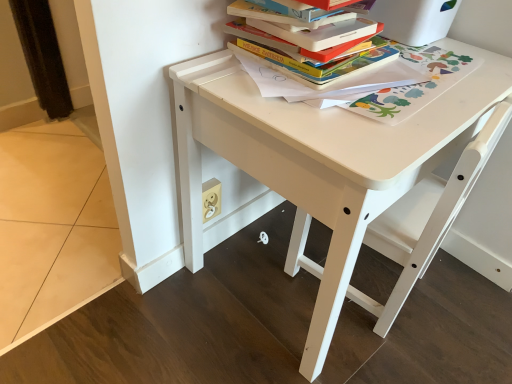
What is the approximate width of white matte table at center?

white matte table at center is 46.55 centimeters in width.

Measure the distance between white matte chair at center and camera.

The depth of white matte chair at center is 26.23 inches.

Measure the distance between point (379, 29) and camera.

Point (379, 29) and camera are 33.54 inches apart from each other.

At what (x,y) coordinates should I click in order to perform the action: click on white matte table at center. Please return your answer as a coordinate pair (x, y). Looking at the image, I should click on (335, 169).

Is hardcover books at upper center turned away from white matte chair at center?

hardcover books at upper center is not turned away from white matte chair at center.

Is hardcover books at upper center directly adjacent to white matte chair at center?

They are not placed beside each other.

How different are the orientations of hardcover books at upper center and hardcover book at upper center in degrees?

The angular difference between hardcover books at upper center and hardcover book at upper center is 0.000134 degrees.

From a real-world perspective, who is located lower, hardcover books at upper center or hardcover book at upper center?

hardcover books at upper center is physically lower.

From the image's perspective, is hardcover books at upper center over hardcover book at upper center?

No.

Identify the location of paperback book on the left side of hardcover books at upper center. Image resolution: width=512 pixels, height=384 pixels. (322, 33).

Which object is positioned more to the left, white matte chair at center or white matte table at center?

white matte table at center is more to the left.

In order to click on table above the white matte chair at center (from a real-world perspective) in this screenshot , I will do `click(335, 169)`.

From the image's perspective, between white matte chair at center and white matte table at center, which one is located above?

white matte table at center, from the image's perspective.

From a real-world perspective, is hardcover book at upper center positioned above or below hardcover books at upper center?

hardcover book at upper center is above hardcover books at upper center.

Would you say hardcover book at upper center is outside hardcover books at upper center?

Absolutely, hardcover book at upper center is external to hardcover books at upper center.

Which is in front, point (343, 39) or point (320, 69)?

The point (320, 69) is in front.

From the image's perspective, which one is positioned lower, hardcover book at upper center or hardcover books at upper center?

hardcover books at upper center.

From the image's perspective, is white matte chair at center over hardcover book at upper center?

No.

I want to click on chair in front of the hardcover book at upper center, so click(x=426, y=218).

Is white matte chair at center positioned far away from hardcover book at upper center?

white matte chair at center is actually quite close to hardcover book at upper center.

Is white matte chair at center in front of or behind hardcover book at upper center in the image?

white matte chair at center is in front of hardcover book at upper center.

Considering the points (187, 105) and (490, 144), which point is in front, point (187, 105) or point (490, 144)?

The point (490, 144) is in front.

Is white matte table at center in front of white matte chair at center?

Yes, white matte table at center is closer to the camera.

Does white matte table at center have a smaller size compared to white matte chair at center?

No.

From the picture: From the image's perspective, which one is positioned higher, white matte table at center or white matte chair at center?

white matte table at center appears higher in the image.

Between white matte chair at center and hardcover books at upper center, which one has smaller size?

With smaller size is hardcover books at upper center.

From the image's perspective, who appears lower, white matte chair at center or hardcover books at upper center?

white matte chair at center appears lower in the image.

Which is in front, white matte chair at center or hardcover books at upper center?

white matte chair at center is closer to the camera.

The width and height of the screenshot is (512, 384). I want to click on chair that appears below the hardcover books at upper center (from the image's perspective), so click(426, 218).

Where is `book that appears on the right of hardcover book at upper center`? The height and width of the screenshot is (384, 512). book that appears on the right of hardcover book at upper center is located at coordinates (311, 54).

Looking at the image, which one is located closer to hardcover books at upper center, hardcover book at upper center or white matte chair at center?

hardcover book at upper center.

Which object lies further to the anchor point hardcover books at upper center, white matte table at center or hardcover book at upper center?

white matte table at center is further to hardcover books at upper center.

From the picture: Estimate the real-world distances between objects in this image. Which object is closer to white matte table at center, hardcover book at upper center or hardcover books at upper center?

hardcover books at upper center is positioned closer to the anchor white matte table at center.

When comparing their distances from white matte table at center, does hardcover books at upper center or white matte chair at center seem further?

hardcover books at upper center is positioned further to the anchor white matte table at center.

Which object lies further to the anchor point white matte chair at center, hardcover books at upper center or white matte table at center?

The object further to white matte chair at center is hardcover books at upper center.

From the picture: Looking at the image, which one is located closer to hardcover book at upper center, white matte table at center or hardcover books at upper center?

Among the two, hardcover books at upper center is located nearer to hardcover book at upper center.

When comparing their distances from white matte table at center, does white matte chair at center or hardcover books at upper center seem closer?

white matte chair at center is closer to white matte table at center.

Looking at the image, which one is located closer to white matte chair at center, hardcover book at upper center or white matte table at center?

white matte table at center lies closer to white matte chair at center than the other object.

Locate an element on the screen. The height and width of the screenshot is (384, 512). table that lies between hardcover books at upper center and white matte chair at center from top to bottom is located at coordinates (335, 169).

Where is `table that lies between hardcover book at upper center and white matte chair at center from top to bottom`? The image size is (512, 384). table that lies between hardcover book at upper center and white matte chair at center from top to bottom is located at coordinates (335, 169).

Find the location of `book between hardcover book at upper center and white matte chair at center in the vertical direction`. book between hardcover book at upper center and white matte chair at center in the vertical direction is located at coordinates (311, 54).

Locate an element on the screen. This screenshot has width=512, height=384. book between hardcover book at upper center and white matte table at center in the up-down direction is located at coordinates (311, 54).